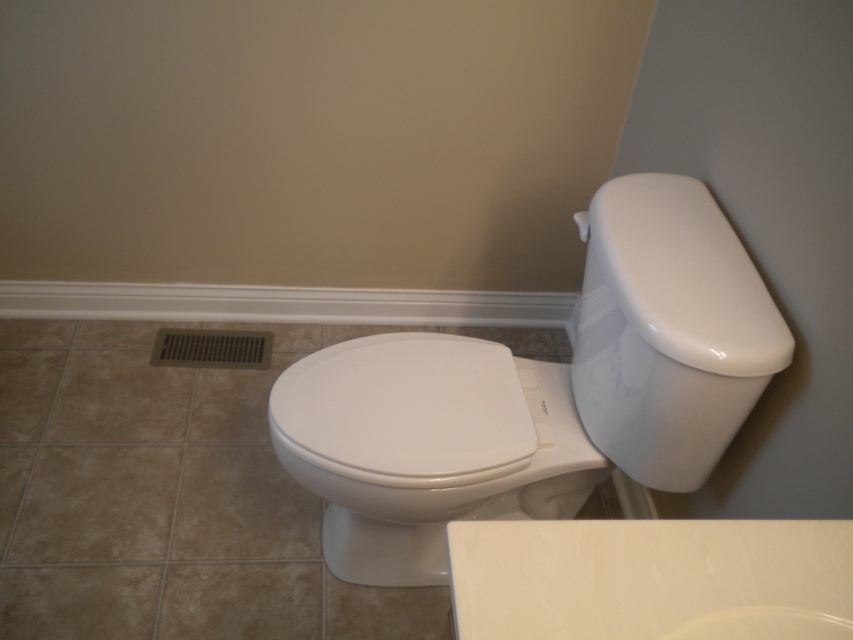
From the picture: You are standing in the bathroom and want to clean the white glossy toilet at center and the white glossy toilet bowl at center. Which one should you clean first if you want to start with the one closer to you?

You should clean the white glossy toilet at center first because it is closer to you than the white glossy toilet bowl at center.